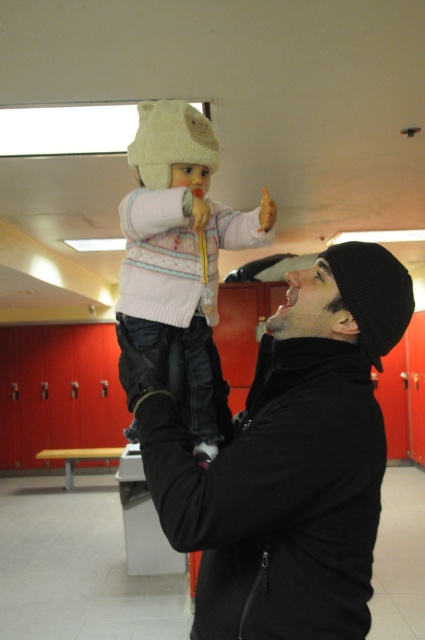
You are a photographer trying to capture a closeup shot of both the black matte jacket at center and the white knitted sweater at center in the locker room scene. Given that your camera has a maximum focus range of 12 inches, will you be able to capture both items in focus without adjusting your camera settings?

The black matte jacket at center and white knitted sweater at center are 11.49 inches apart from each other. Since this distance is within the camera maximum focus range of 12 inches, you can capture both items in focus without adjusting your camera settings.